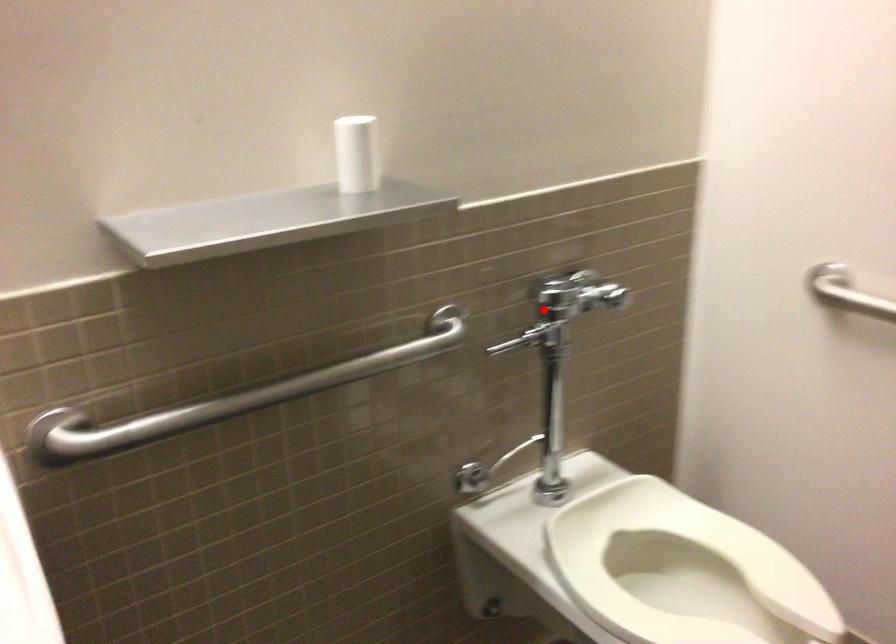
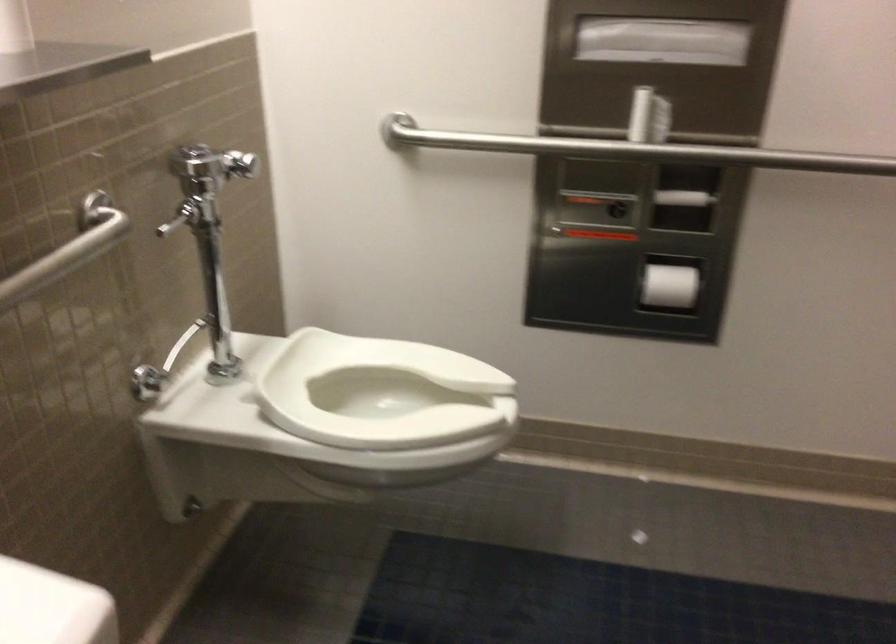
Locate, in the second image, the point that corresponds to the highlighted location in the first image.

(203, 180)